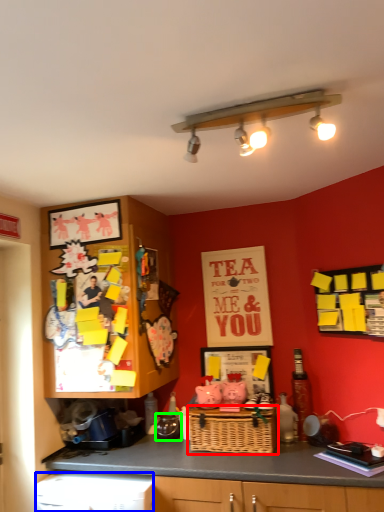
Question: Which object is positioned closest to basket (highlighted by a red box)? Select from dish washer (highlighted by a blue box) and appliance (highlighted by a green box).

Choices:
 (A) dish washer
 (B) appliance

Answer: (B)